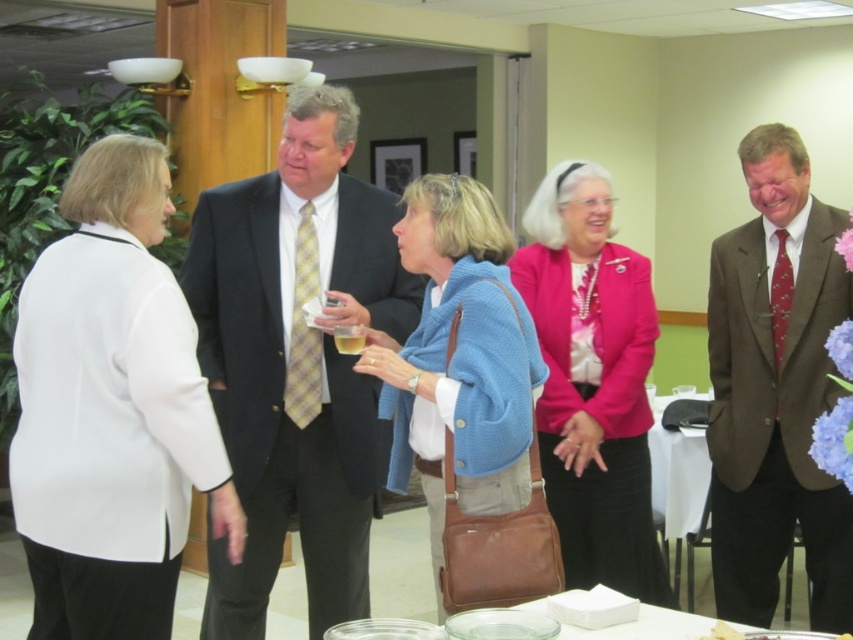
How distant is blue knitted sweater at center from clear glass plates at center?

blue knitted sweater at center and clear glass plates at center are 64.34 centimeters apart from each other.

Which is in front, point (503, 234) or point (387, 620)?

Point (387, 620)

Find the location of `blue knitted sweater at center`. blue knitted sweater at center is located at coordinates (459, 358).

Can you confirm if brown textured suit at center is taller than pink satin jacket at center?

Yes, brown textured suit at center is taller than pink satin jacket at center.

Is brown textured suit at center wider than pink satin jacket at center?

No.

Is point (706, 436) farther from camera compared to point (596, 273)?

No.

This screenshot has height=640, width=853. I want to click on brown textured suit at center, so click(x=775, y=390).

What do you see at coordinates (592, 381) in the screenshot? I see `pink satin jacket at center` at bounding box center [592, 381].

Is pink satin jacket at center smaller than blue knitted sweater at center?

No.

At what (x,y) coordinates should I click in order to perform the action: click on pink satin jacket at center. Please return your answer as a coordinate pair (x, y). Image resolution: width=853 pixels, height=640 pixels. Looking at the image, I should click on (592, 381).

Where is `pink satin jacket at center`? This screenshot has width=853, height=640. pink satin jacket at center is located at coordinates (592, 381).